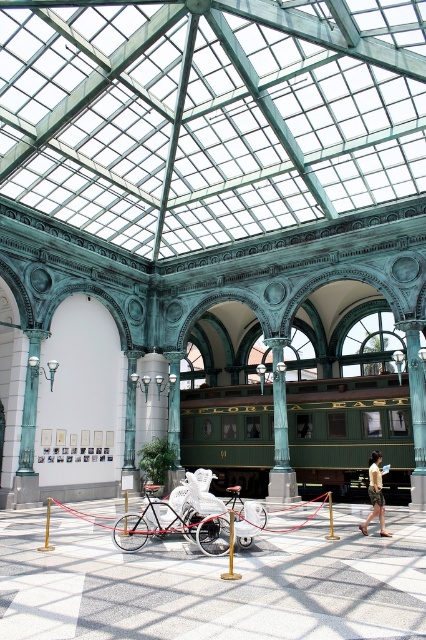
Question: Among these objects, which one is nearest to the camera?

Choices:
 (A) green polished stone column at center
 (B) camouflage shorts at center

Answer: (B)

Question: Does green polished pillar at center appear on the right side of camouflage shorts at center?

Choices:
 (A) yes
 (B) no

Answer: (A)

Question: Is green polished stone column at center behind camouflage shorts at center?

Choices:
 (A) no
 (B) yes

Answer: (B)

Question: Where is green polished wood train car at center located in relation to red matte tricycle at center in the image?

Choices:
 (A) above
 (B) below

Answer: (A)

Question: Which of the following is the farthest from the observer?

Choices:
 (A) (265, 417)
 (B) (221, 579)
 (C) (124, 541)
 (D) (276, 465)

Answer: (A)

Question: Which of the following is the closest to the observer?

Choices:
 (A) (417, 474)
 (B) (247, 529)
 (C) (212, 500)

Answer: (B)